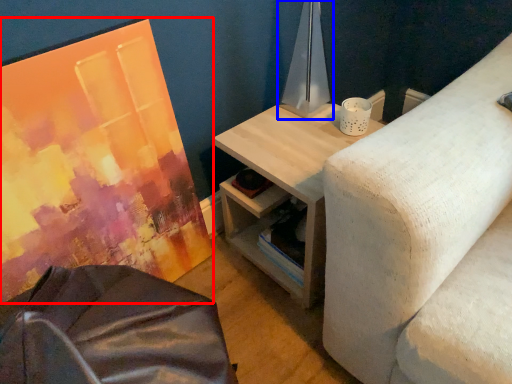
Question: Which object appears closest to the camera in this image, canvas (highlighted by a red box) or table lamp (highlighted by a blue box)?

Choices:
 (A) canvas
 (B) table lamp

Answer: (A)